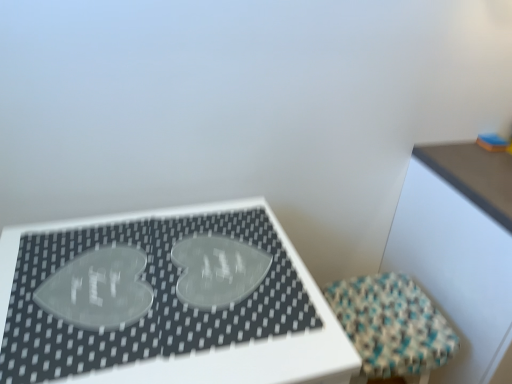
Question: Is wooden table at upper right, the 2th table when ordered from left to right, behind transparent pet heart at center, marked as the second table in a right-to-left arrangement?

Choices:
 (A) yes
 (B) no

Answer: (A)

Question: From the image's perspective, is wooden table at upper right, the first table when ordered from right to left, located above transparent pet heart at center, placed as the 1th table when sorted from left to right?

Choices:
 (A) no
 (B) yes

Answer: (B)

Question: Can we say wooden table at upper right, the 2th table when ordered from left to right, lies outside transparent pet heart at center, placed as the 1th table when sorted from left to right?

Choices:
 (A) no
 (B) yes

Answer: (B)

Question: Is wooden table at upper right, the first table when ordered from right to left, bigger than transparent pet heart at center, marked as the second table in a right-to-left arrangement?

Choices:
 (A) yes
 (B) no

Answer: (A)

Question: From a real-world perspective, is wooden table at upper right, the 2th table when ordered from left to right, on top of transparent pet heart at center, placed as the 1th table when sorted from left to right?

Choices:
 (A) yes
 (B) no

Answer: (A)

Question: From the image's perspective, is textured woven stool at lower right positioned above or below wooden table at upper right, the first table when ordered from right to left?

Choices:
 (A) below
 (B) above

Answer: (A)

Question: Considering the positions of point (354, 304) and point (422, 193), is point (354, 304) closer or farther from the camera than point (422, 193)?

Choices:
 (A) closer
 (B) farther

Answer: (A)

Question: Is textured woven stool at lower right taller or shorter than wooden table at upper right, the first table when ordered from right to left?

Choices:
 (A) tall
 (B) short

Answer: (B)

Question: Is textured woven stool at lower right wider or thinner than wooden table at upper right, the first table when ordered from right to left?

Choices:
 (A) thin
 (B) wide

Answer: (A)

Question: From the image's perspective, is wooden table at upper right, the 2th table when ordered from left to right, above or below textured woven stool at lower right?

Choices:
 (A) above
 (B) below

Answer: (A)

Question: Considering their positions, is wooden table at upper right, the first table when ordered from right to left, located in front of or behind textured woven stool at lower right?

Choices:
 (A) behind
 (B) front

Answer: (B)

Question: Choose the correct answer: Is wooden table at upper right, the 2th table when ordered from left to right, inside textured woven stool at lower right or outside it?

Choices:
 (A) outside
 (B) inside

Answer: (A)

Question: Based on their positions, is wooden table at upper right, the 2th table when ordered from left to right, located to the left or right of textured woven stool at lower right?

Choices:
 (A) right
 (B) left

Answer: (A)

Question: In terms of size, does textured woven stool at lower right appear bigger or smaller than transparent pet heart at center, marked as the second table in a right-to-left arrangement?

Choices:
 (A) small
 (B) big

Answer: (A)

Question: Considering the positions of textured woven stool at lower right and transparent pet heart at center, placed as the 1th table when sorted from left to right, in the image, is textured woven stool at lower right taller or shorter than transparent pet heart at center, placed as the 1th table when sorted from left to right,?

Choices:
 (A) short
 (B) tall

Answer: (A)